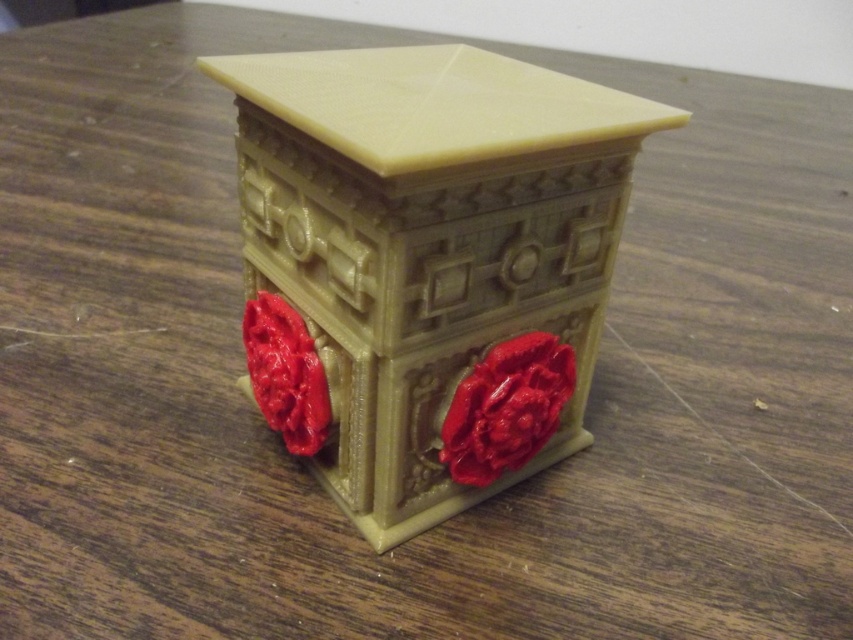
Question: Estimate the real-world distances between objects in this image. Which object is closer to the matte red flower at lower right?

Choices:
 (A) matte beige cabinet at center
 (B) matte plastic flower at center

Answer: (A)

Question: Does matte red flower at lower right appear under matte plastic flower at center?

Choices:
 (A) yes
 (B) no

Answer: (A)

Question: Which object is the closest to the matte beige cabinet at center?

Choices:
 (A) matte red flower at lower right
 (B) matte plastic flower at center

Answer: (A)

Question: Can you confirm if matte beige cabinet at center is bigger than matte plastic flower at center?

Choices:
 (A) no
 (B) yes

Answer: (B)

Question: Which point is farther to the camera?

Choices:
 (A) matte red flower at lower right
 (B) matte beige cabinet at center

Answer: (A)

Question: Is matte beige cabinet at center to the left of matte red flower at lower right from the viewer's perspective?

Choices:
 (A) no
 (B) yes

Answer: (B)